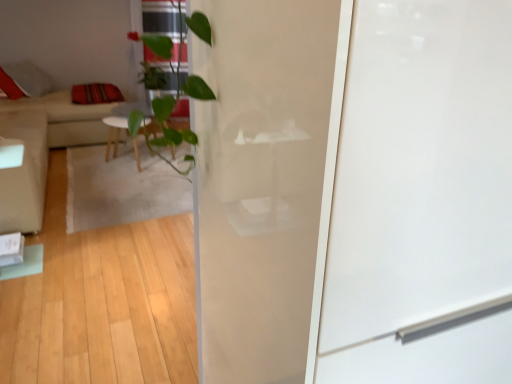
Question: From a real-world perspective, does transparent glass screen door at center stand above beige fabric couch at left?

Choices:
 (A) yes
 (B) no

Answer: (A)

Question: From a real-world perspective, is transparent glass screen door at center beneath beige fabric couch at left?

Choices:
 (A) no
 (B) yes

Answer: (A)

Question: Is transparent glass screen door at center placed right next to beige fabric couch at left?

Choices:
 (A) yes
 (B) no

Answer: (B)

Question: Considering the relative positions of transparent glass screen door at center and beige fabric couch at left in the image provided, is transparent glass screen door at center to the right of beige fabric couch at left from the viewer's perspective?

Choices:
 (A) no
 (B) yes

Answer: (B)

Question: Is transparent glass screen door at center taller than beige fabric couch at left?

Choices:
 (A) no
 (B) yes

Answer: (B)

Question: In terms of height, does beige fabric armchair at left look taller or shorter compared to transparent glass screen door at center?

Choices:
 (A) short
 (B) tall

Answer: (A)

Question: Visually, is beige fabric armchair at left positioned to the left or to the right of transparent glass screen door at center?

Choices:
 (A) right
 (B) left

Answer: (B)

Question: Looking at the image, does beige fabric armchair at left seem bigger or smaller compared to transparent glass screen door at center?

Choices:
 (A) small
 (B) big

Answer: (A)

Question: Is beige fabric armchair at left wider or thinner than transparent glass screen door at center?

Choices:
 (A) thin
 (B) wide

Answer: (A)

Question: In terms of height, does transparent glass screen door at center look taller or shorter compared to striped fabric pillow at left?

Choices:
 (A) tall
 (B) short

Answer: (A)

Question: Looking at their shapes, would you say transparent glass screen door at center is wider or thinner than striped fabric pillow at left?

Choices:
 (A) thin
 (B) wide

Answer: (B)

Question: From a real-world perspective, is transparent glass screen door at center positioned above or below striped fabric pillow at left?

Choices:
 (A) below
 (B) above

Answer: (B)

Question: Considering the relative positions of transparent glass screen door at center and striped fabric pillow at left in the image provided, is transparent glass screen door at center to the left or to the right of striped fabric pillow at left?

Choices:
 (A) left
 (B) right

Answer: (B)

Question: From a real-world perspective, is striped fabric pillow at left physically located above or below transparent glass screen door at center?

Choices:
 (A) above
 (B) below

Answer: (B)

Question: Relative to transparent glass screen door at center, is striped fabric pillow at left in front or behind?

Choices:
 (A) behind
 (B) front

Answer: (A)